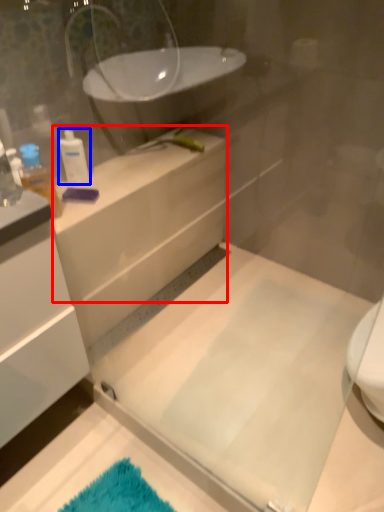
Question: Which object appears farthest to the camera in this image, counter top (highlighted by a red box) or toiletry (highlighted by a blue box)?

Choices:
 (A) counter top
 (B) toiletry

Answer: (B)